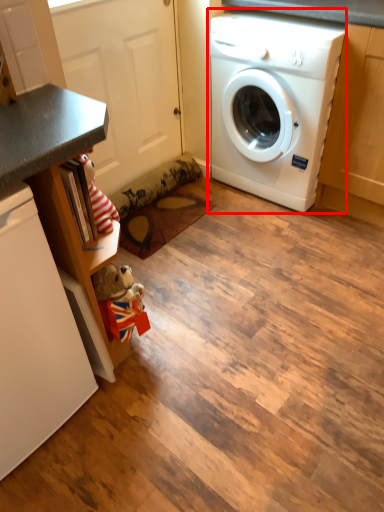
Question: Where is washing machine (annotated by the red box) located in relation to dish washer in the image?

Choices:
 (A) left
 (B) right

Answer: (B)